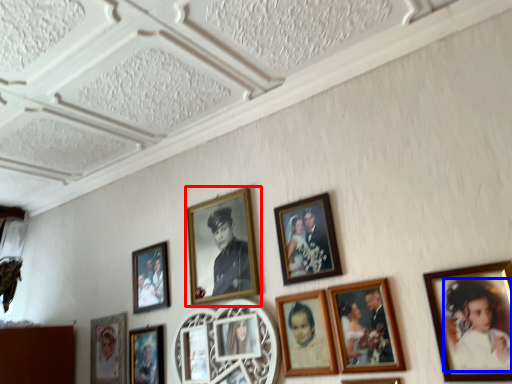
Question: Which object is closer to the camera taking this photo, picture frame (highlighted by a red box) or person (highlighted by a blue box)?

Choices:
 (A) picture frame
 (B) person

Answer: (B)